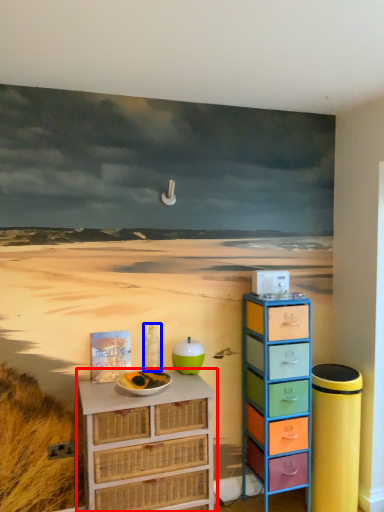
Question: Which of the following is the farthest to the observer, chest of drawers (highlighted by a red box) or bottle (highlighted by a blue box)?

Choices:
 (A) chest of drawers
 (B) bottle

Answer: (B)